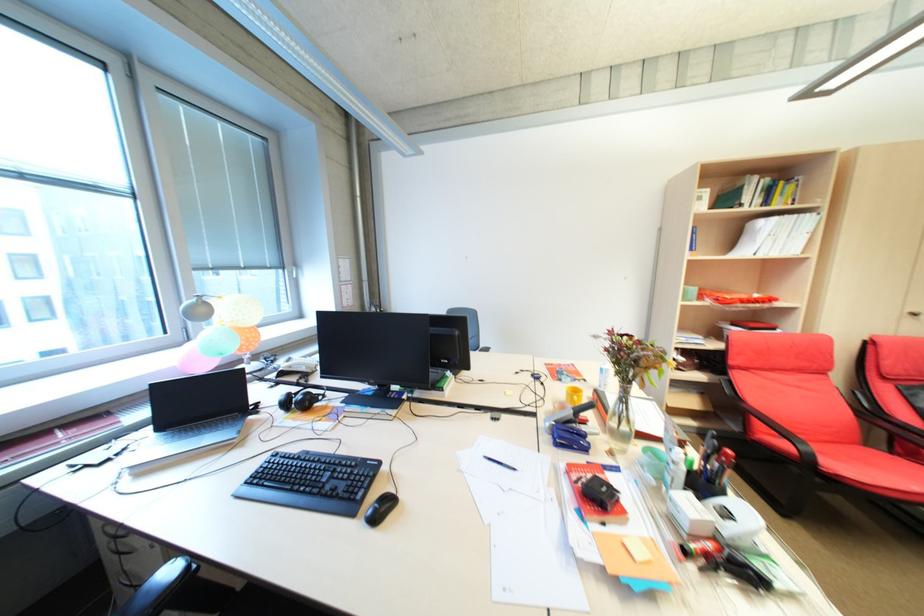
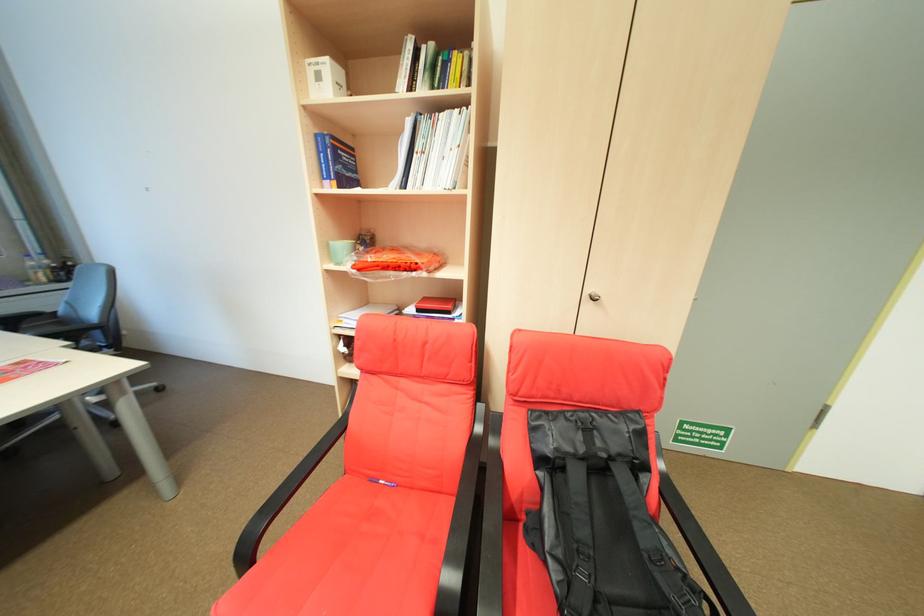
Question: What movement of the cameraman would produce the second image?

Choices:
 (A) Left
 (B) Right
 (C) Forward
 (D) Backward

Answer: (B)